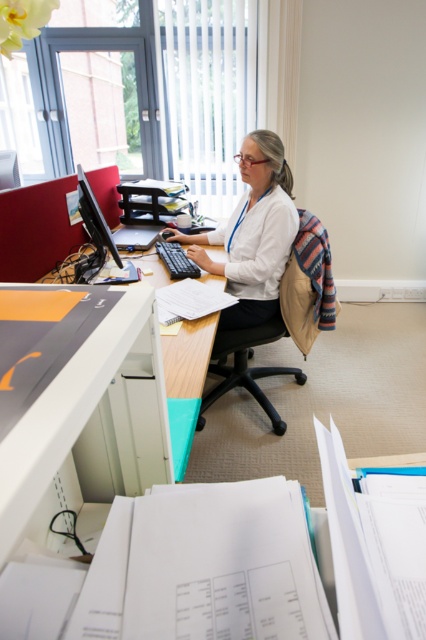
You are an office cleaner and need to clean the white matte shirt at center and the matte black monitor at left. Which object requires a larger cleaning area?

The white matte shirt at center requires a larger cleaning area because it has a larger size compared to the matte black monitor at left.

You are standing at the point marked as point (x=227, y=376) in the office. You need to reach the door located at the opposite side of the room. The minimum distance you can move in a straight line without encountering any obstacles is 8.30 feet. Is this distance sufficient to reach the door without any obstructions?

The minimum distance you can move in a straight line without encountering any obstacles is 8.30 feet, so yes, this distance is sufficient to reach the door located at the opposite side of the room without any obstructions.

You are an office worker who needs to adjust the monitor settings. You are currently sitting in front of the white matte shirt at center. Which direction should you move to reach the matte black monitor at left?

The matte black monitor at left is behind the white matte shirt at center, so you should move backward to reach it.